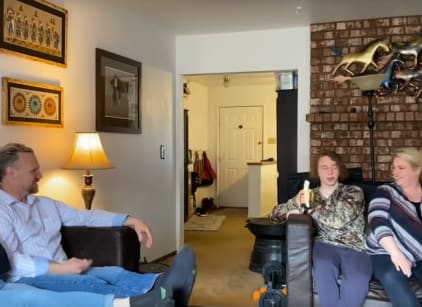
This screenshot has width=422, height=307. In order to click on door in this screenshot , I will do `click(242, 139)`.